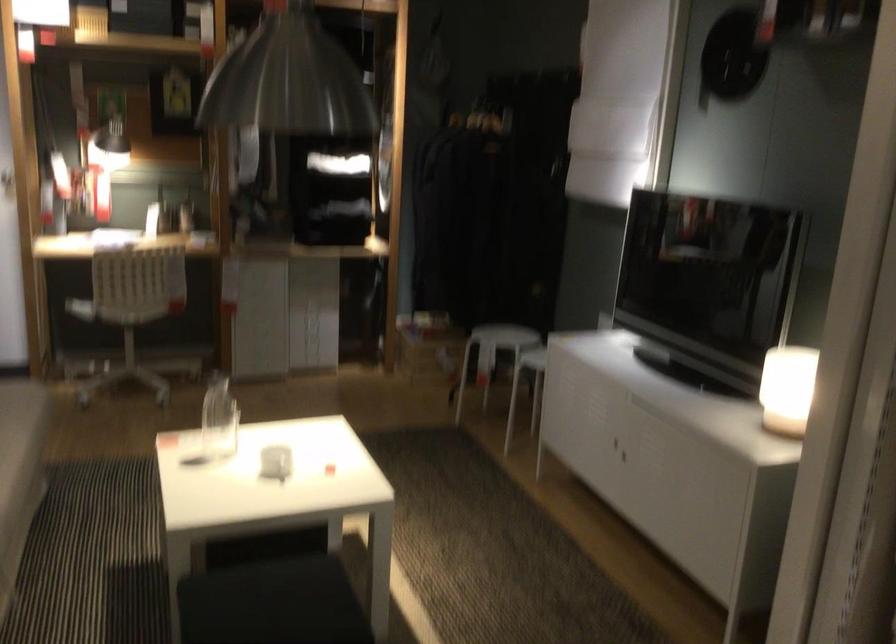
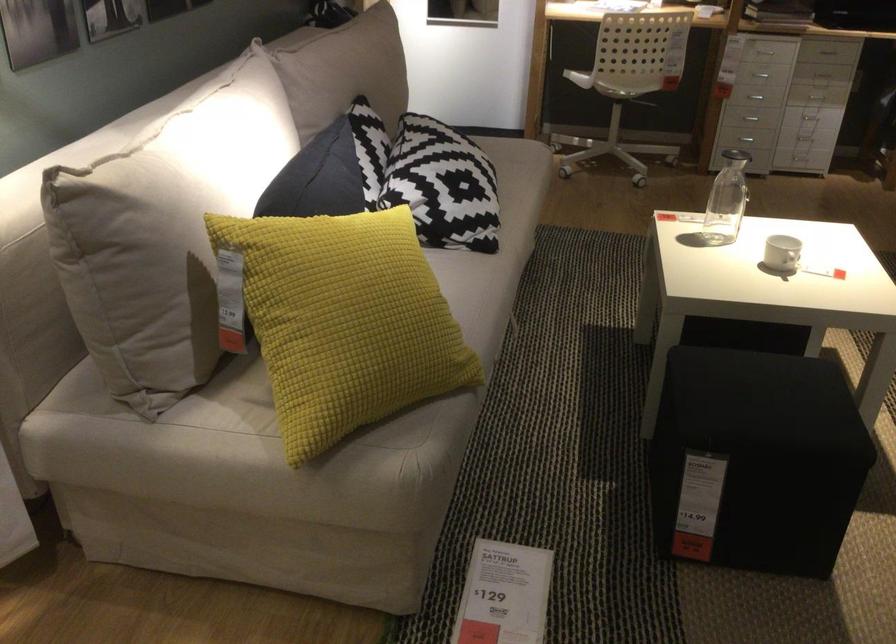
Find the pixel in the second image that matches (x=128, y=314) in the first image.

(627, 80)